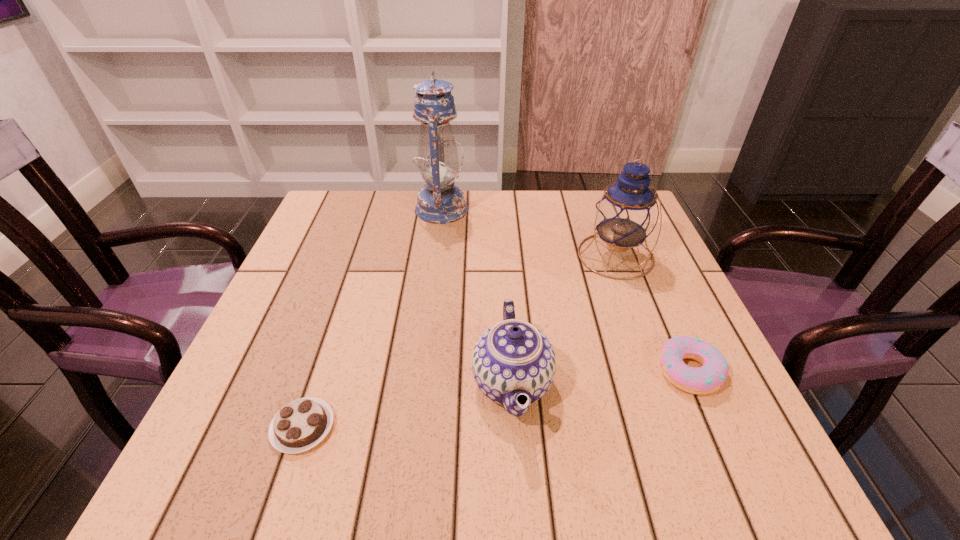
Find the location of `the taller lantern`. the taller lantern is located at coordinates click(440, 202).

Locate an element on the screen. This screenshot has height=540, width=960. the left lantern is located at coordinates (440, 202).

Locate an element on the screen. This screenshot has width=960, height=540. the right lantern is located at coordinates (626, 214).

Where is `the nearer lantern`? Image resolution: width=960 pixels, height=540 pixels. the nearer lantern is located at coordinates (626, 214).

Where is `the third object from right to left`? the third object from right to left is located at coordinates (511, 358).

This screenshot has height=540, width=960. In order to click on the third tallest object in this screenshot , I will do `click(511, 358)`.

The image size is (960, 540). In order to click on the fourth tallest object in this screenshot , I will do coord(707,379).

Identify the location of the shortest object. (300, 425).

Image resolution: width=960 pixels, height=540 pixels. In order to click on the leftmost object in this screenshot , I will do `click(300, 425)`.

Locate an element on the screen. Image resolution: width=960 pixels, height=540 pixels. vacant space located on the front-facing side of the tallest object is located at coordinates (596, 209).